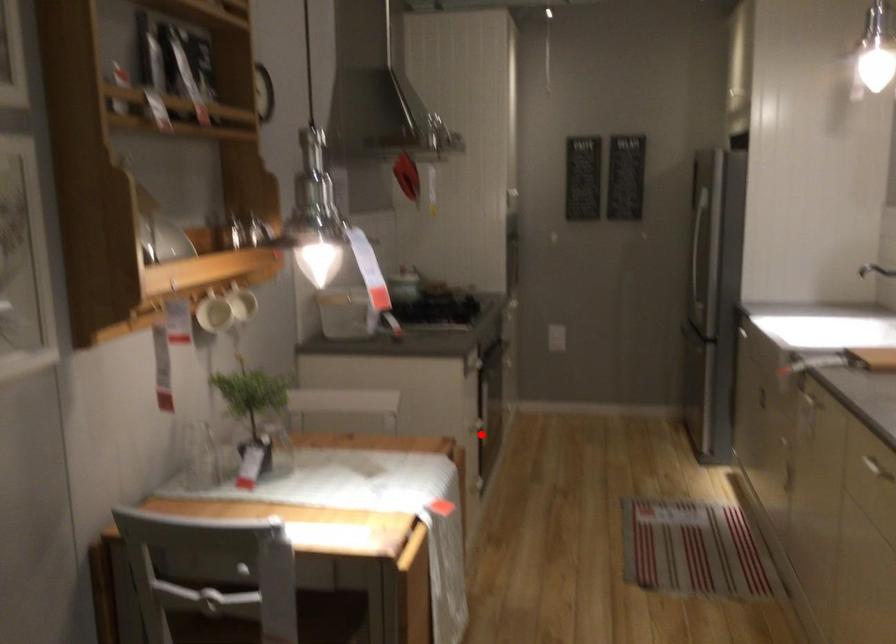
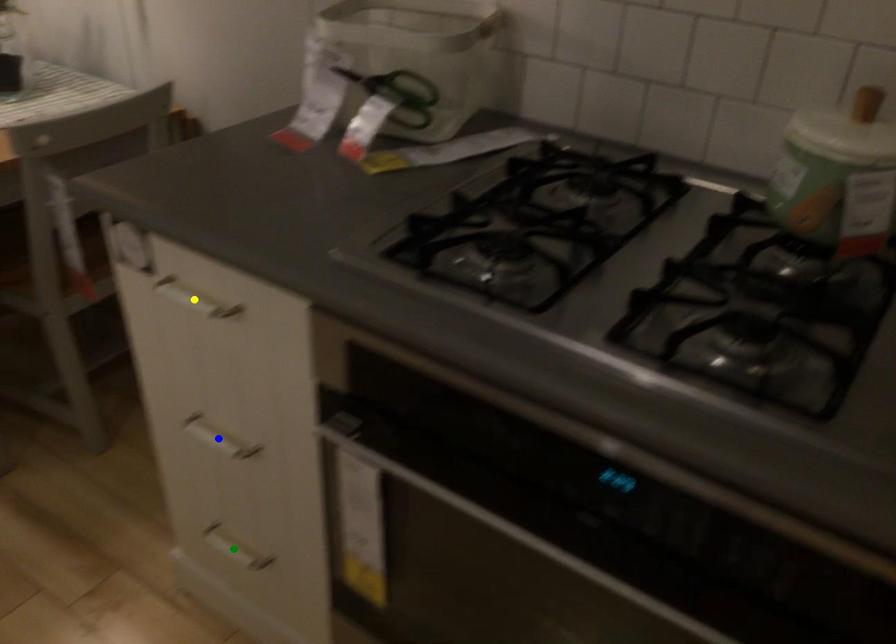
Question: I am providing you with two images of the same scene from different viewpoints. A red point is marked on the first image. You are given multiple points on the second image. Which point in image 2 is actually the same real-world point as the red point in image 1?

Choices:
 (A) blue point
 (B) green point
 (C) yellow point

Answer: (A)